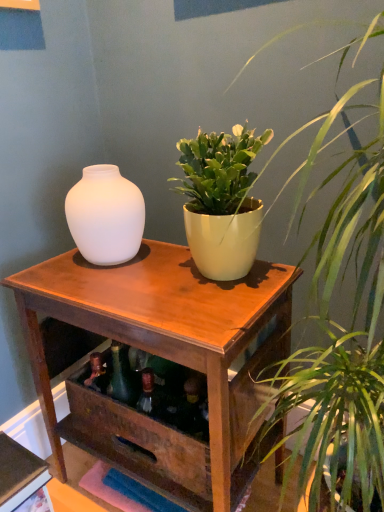
This screenshot has height=512, width=384. I want to click on vacant region in front of green matte plant pot at center, marked as the 1th houseplant in a top-to-bottom arrangement, so click(x=197, y=312).